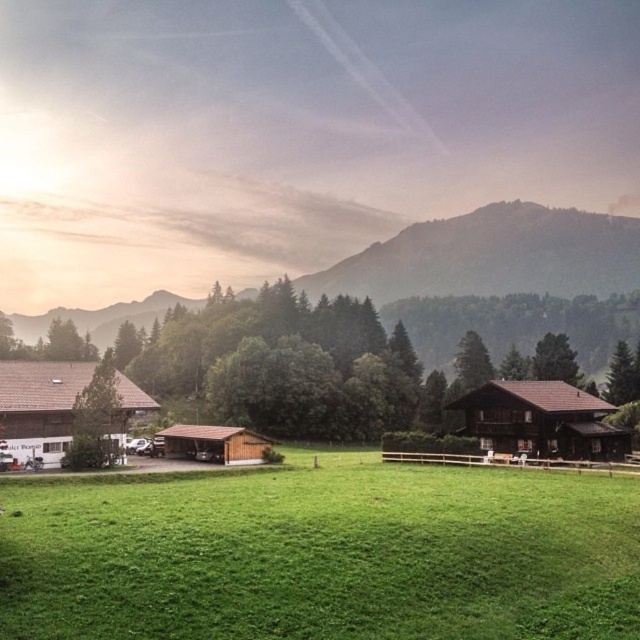
Based on the scene description, where is the green grassy field at center located in terms of its 2D coordinates?

The green grassy field at center is located at the 2D coordinates point (321, 554).

You are standing in the field and want to take a photo of both the point at [200,552] and the point at [579,452]. Which point will appear larger in your photo?

Point at [200,552] will appear larger in the photo because it is closer to the camera than point at [579,452].

What are the coordinates of the green grassy field at center?

The green grassy field at center is located at coordinates point (321,554).